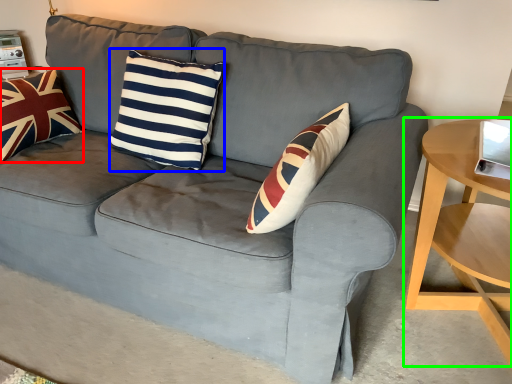
Question: Estimate the real-world distances between objects in this image. Which object is closer to pillow (highlighted by a red box), pillow (highlighted by a blue box) or table (highlighted by a green box)?

Choices:
 (A) pillow
 (B) table

Answer: (A)